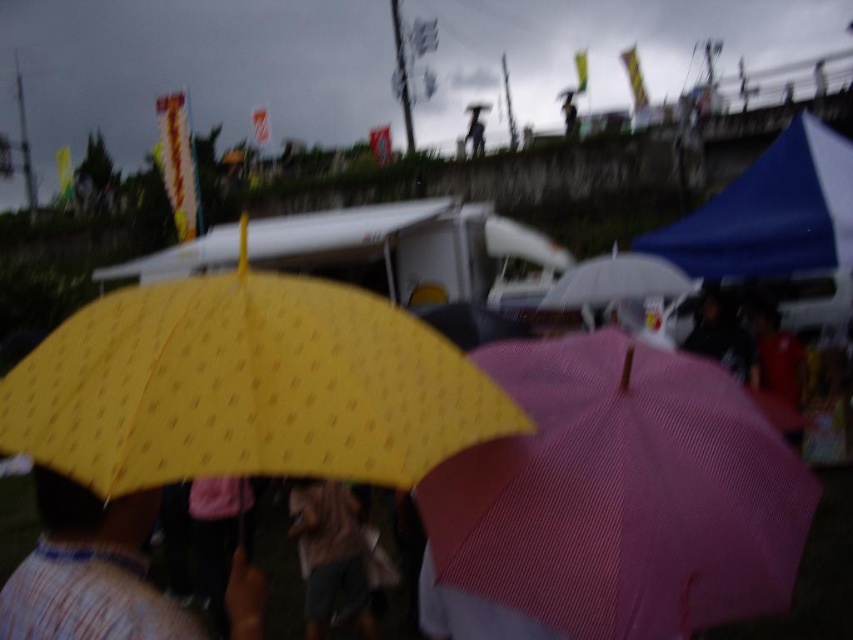
Measure the distance between point (102,353) and camera.

4.71 feet

What do you see at coordinates (247, 387) in the screenshot? Image resolution: width=853 pixels, height=640 pixels. I see `yellow dotted umbrella at center` at bounding box center [247, 387].

This screenshot has height=640, width=853. Find the location of `yellow dotted umbrella at center`. yellow dotted umbrella at center is located at coordinates (247, 387).

Is yellow dotted umbrella at center wider than brown fabric umbrella at center?

Yes, yellow dotted umbrella at center is wider than brown fabric umbrella at center.

Which is in front, point (170, 404) or point (318, 600)?

Point (170, 404)

Is point (154, 433) more distant than point (326, 536)?

No, it is in front of (326, 536).

The image size is (853, 640). Identify the location of yellow dotted umbrella at center. (247, 387).

Is pink fabric umbrella at center below yellow matte umbrella at lower left?

No, pink fabric umbrella at center is not below yellow matte umbrella at lower left.

Between point (476, 456) and point (10, 596), which one is positioned in front?

Positioned in front is point (10, 596).

Which is in front, point (711, 420) or point (132, 595)?

Point (132, 595)

The height and width of the screenshot is (640, 853). Identify the location of pink fabric umbrella at center. (621, 493).